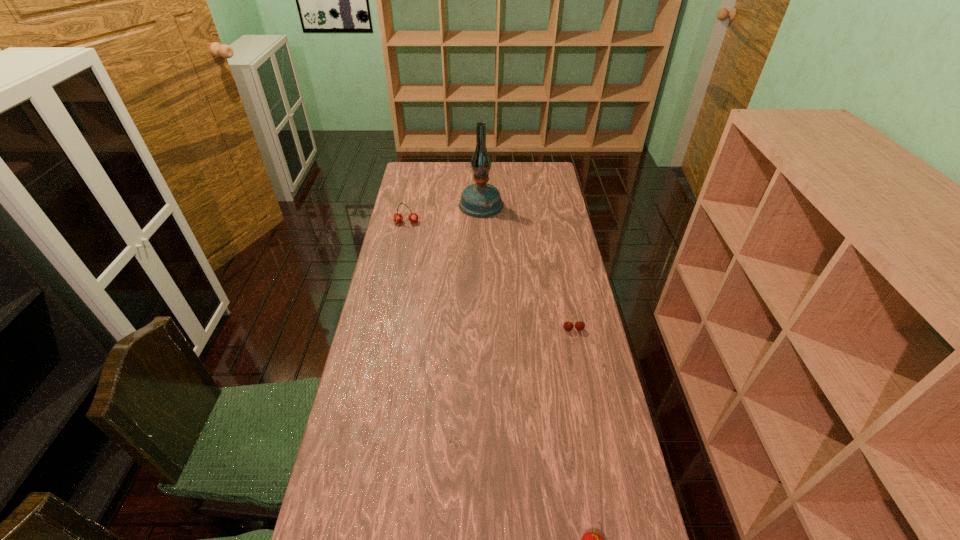
The width and height of the screenshot is (960, 540). Find the location of `object located in the right edge section of the desktop`. object located in the right edge section of the desktop is located at coordinates (568, 326).

Locate an element on the screen. vacant space at the far edge of the desktop is located at coordinates (492, 163).

Find the location of `free space at the left edge`. free space at the left edge is located at coordinates (427, 231).

This screenshot has height=540, width=960. I want to click on vacant area at the right edge, so click(557, 208).

Where is `vacant space at the far left corner of the desktop`? vacant space at the far left corner of the desktop is located at coordinates (424, 168).

The width and height of the screenshot is (960, 540). Find the location of `unoccupied area between the third object from right to left and the shortest object`. unoccupied area between the third object from right to left and the shortest object is located at coordinates (527, 267).

Where is `free space that is in between the tallest object and the leftmost cherry`? This screenshot has width=960, height=540. free space that is in between the tallest object and the leftmost cherry is located at coordinates (444, 213).

Where is `vacant space that is in between the second farthest object and the second nearest object`? vacant space that is in between the second farthest object and the second nearest object is located at coordinates (490, 276).

Where is `vacant space that is in between the tallest object and the second nearest object`? vacant space that is in between the tallest object and the second nearest object is located at coordinates (527, 267).

The image size is (960, 540). I want to click on free space between the second object from left to right and the second farthest object, so click(444, 213).